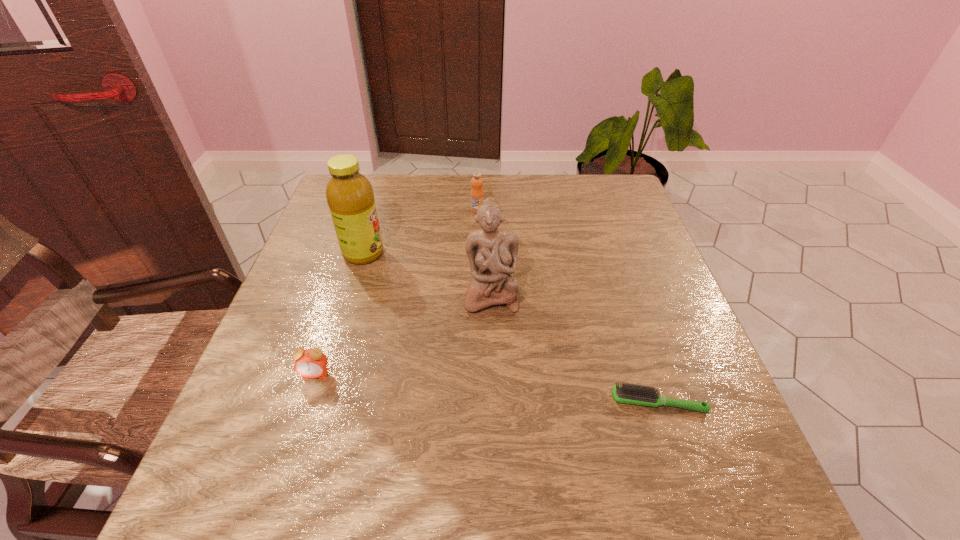
Locate an element on the screen. Image resolution: width=960 pixels, height=540 pixels. free space that satisfies the following two spatial constraints: 1. on the front label of the nearest object; 2. on the right side of the farthest object is located at coordinates (476, 402).

At what (x,y) coordinates should I click in order to perform the action: click on blank space that satisfies the following two spatial constraints: 1. on the front label of the farthest object; 2. on the front label of the second farthest object. Please return your answer as a coordinate pair (x, y). This screenshot has height=540, width=960. Looking at the image, I should click on (477, 253).

Identify the location of vacant space that satisfies the following two spatial constraints: 1. on the front label of the nearest object; 2. on the right side of the third tallest object. (476, 402).